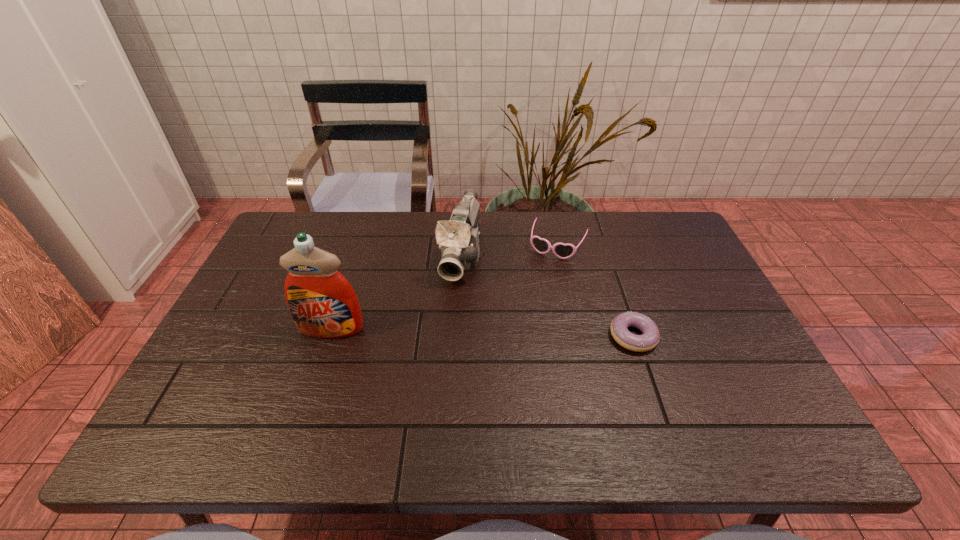
The image size is (960, 540). I want to click on free space between the second shortest object and the third shortest object, so click(509, 251).

I want to click on vacant region between the detergent and the second tallest object, so click(x=396, y=292).

Identify the location of free area in between the camcorder and the doughnut. The height and width of the screenshot is (540, 960). (547, 295).

Find the location of a particular element. This screenshot has height=540, width=960. vacant area between the leftmost object and the third object from right to left is located at coordinates point(396,292).

Locate an element on the screen. This screenshot has width=960, height=540. vacant space in between the tallest object and the shortest object is located at coordinates (482, 333).

Identify the location of free point between the second object from left to right and the third tallest object. (509, 251).

Identify the location of vacant space in between the sunglasses and the doughnut. (595, 291).

Where is `vacant point located between the tallest object and the doughnut`? vacant point located between the tallest object and the doughnut is located at coordinates (482, 333).

This screenshot has width=960, height=540. Find the location of `empty location between the tallest object and the second shortest object`. empty location between the tallest object and the second shortest object is located at coordinates (444, 288).

Locate an element on the screen. The height and width of the screenshot is (540, 960). free spot between the third shortest object and the shortest object is located at coordinates (547, 295).